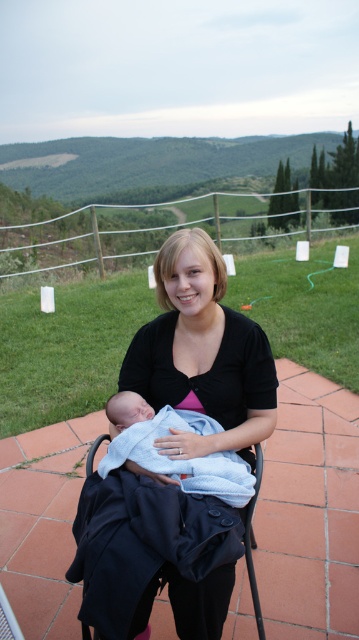
Does black fabric at center have a greater width compared to black fabric folding chair at center?

No.

Who is higher up, black fabric at center or black fabric folding chair at center?

black fabric at center is higher up.

Where is `black fabric at center`? The height and width of the screenshot is (640, 359). black fabric at center is located at coordinates (202, 353).

Where is `black fabric at center`? black fabric at center is located at coordinates (202, 353).

Does point (179, 385) come closer to viewer compared to point (151, 435)?

No, (179, 385) is behind (151, 435).

Identify the location of black fabric at center. This screenshot has width=359, height=640. (x=202, y=353).

Is black fabric folding chair at center above blue cotton blanket at center?

No, black fabric folding chair at center is not above blue cotton blanket at center.

Does point (77, 525) come closer to viewer compared to point (134, 406)?

That is True.

Which is in front, point (129, 516) or point (189, 480)?

Point (129, 516) is in front.

Find the location of a particular element. Image resolution: width=359 pixels, height=640 pixels. black fabric folding chair at center is located at coordinates (150, 541).